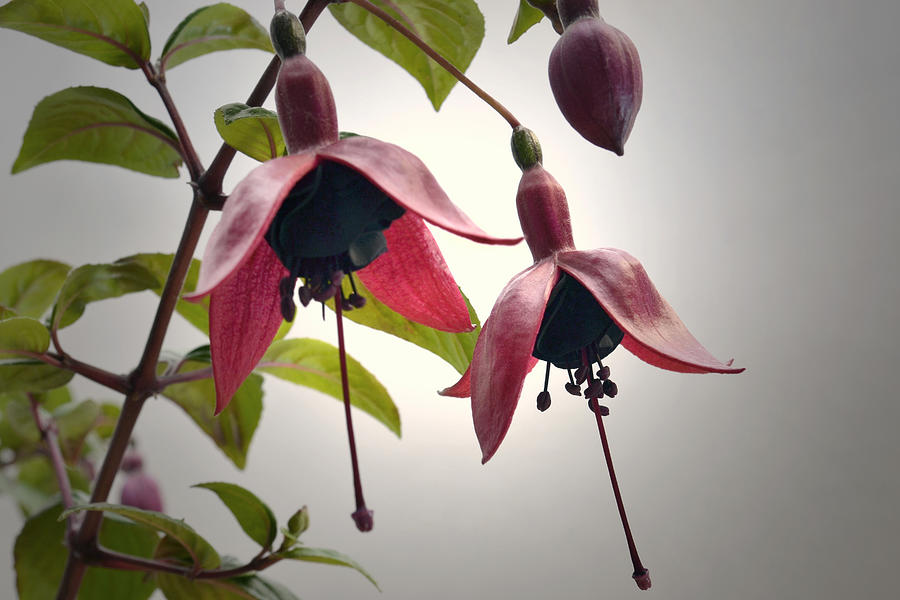
Identify the location of wall. This screenshot has width=900, height=600. (750, 219).